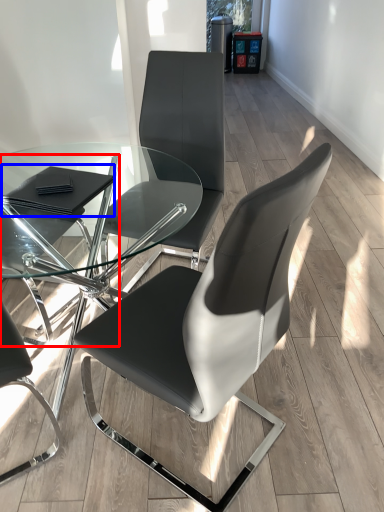
Question: Among these objects, which one is nearest to the camera, chair (highlighted by a red box) or pad (highlighted by a blue box)?

Choices:
 (A) chair
 (B) pad

Answer: (A)